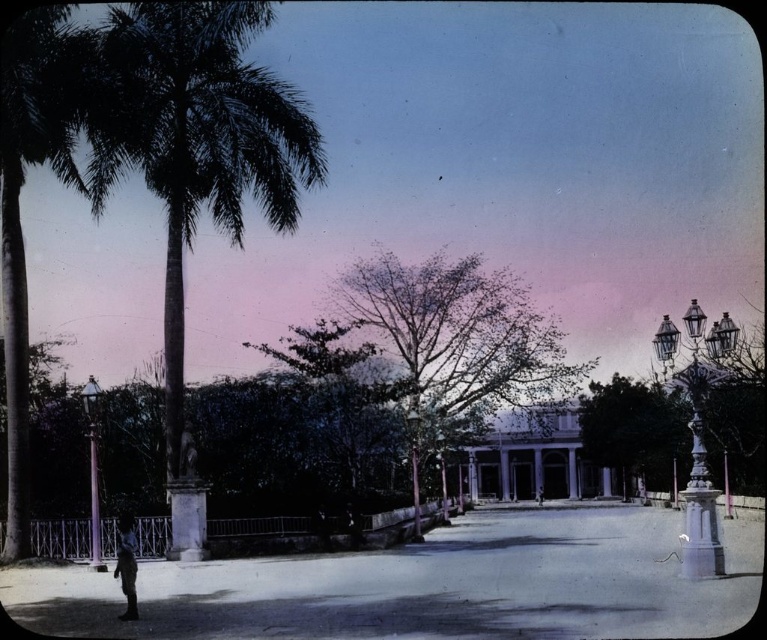
You are standing in the plaza and want to take a photo of the point at coordinates (723, 560). The camera you are using has a maximum focus range of 15 meters. Will the point be in focus?

The point at coordinates (723, 560) is 16.25 meters away from the camera, which exceeds the maximum focus range of 15 meters. Therefore, the point will not be in focus.